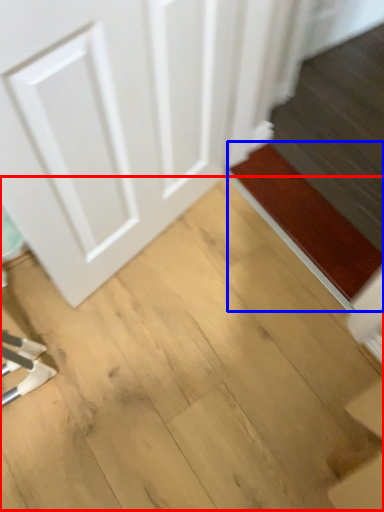
Question: Which of the following is the closest to the observer, plywood (highlighted by a red box) or doormat (highlighted by a blue box)?

Choices:
 (A) plywood
 (B) doormat

Answer: (A)